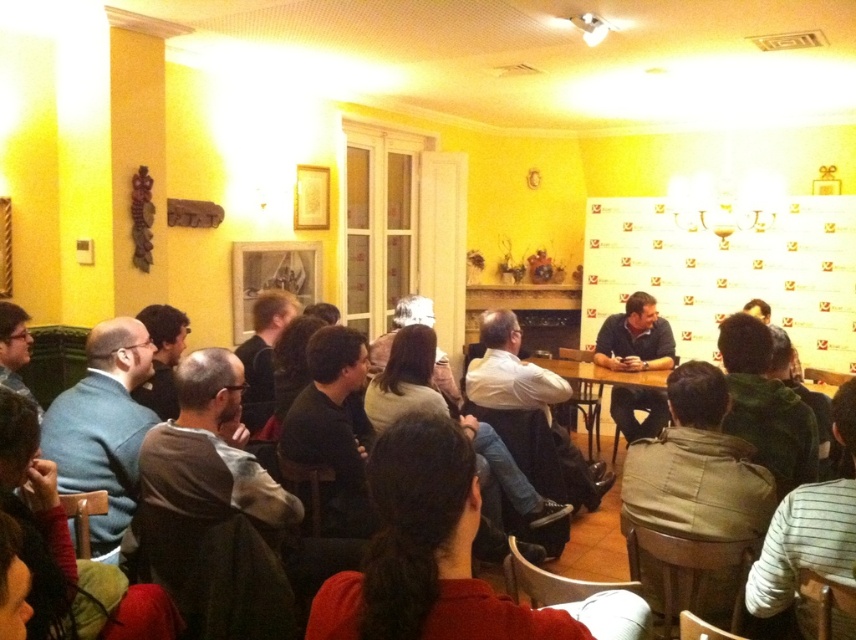
Question: Can you confirm if dark blue shirt at center is positioned above wooden table at center?

Choices:
 (A) no
 (B) yes

Answer: (A)

Question: Which point is closer to the camera taking this photo?

Choices:
 (A) (617, 385)
 (B) (643, 328)

Answer: (A)

Question: Is dark blue shirt at center further to the viewer compared to wooden table at center?

Choices:
 (A) yes
 (B) no

Answer: (A)

Question: Is dark blue shirt at center below wooden table at center?

Choices:
 (A) no
 (B) yes

Answer: (B)

Question: Which point is farther from the camera taking this photo?

Choices:
 (A) (598, 369)
 (B) (605, 362)

Answer: (B)